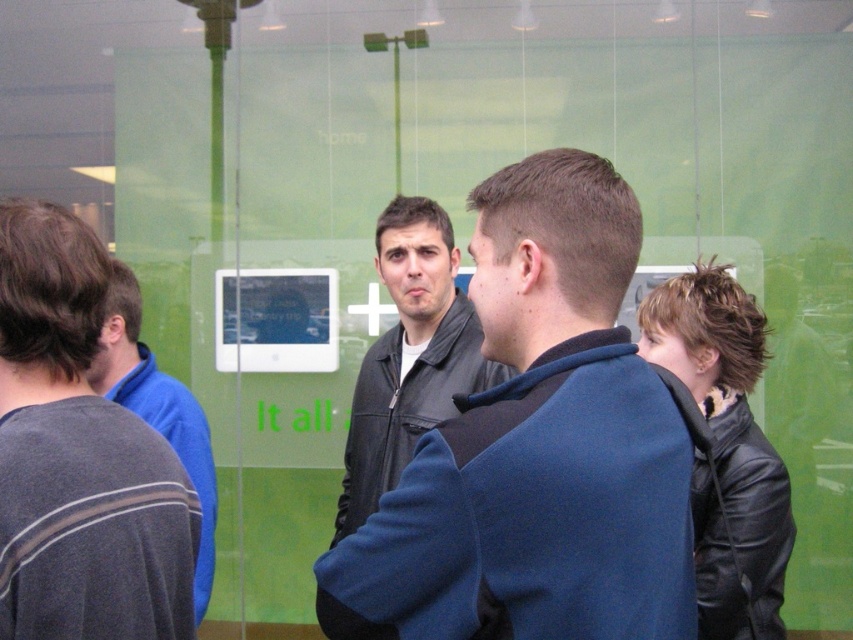
Question: Is the position of leather jacket at center less distant than that of dark gray leather jacket at center?

Choices:
 (A) no
 (B) yes

Answer: (B)

Question: Does leather jacket at center appear under dark gray leather jacket at center?

Choices:
 (A) yes
 (B) no

Answer: (B)

Question: Where is leather jacket at center located in relation to dark gray leather jacket at center in the image?

Choices:
 (A) right
 (B) left

Answer: (A)

Question: Among these points, which one is nearest to the camera?

Choices:
 (A) (619, 248)
 (B) (102, 426)
 (C) (728, 566)

Answer: (A)

Question: Which of the following is the closest to the observer?

Choices:
 (A) (531, 502)
 (B) (732, 484)
 (C) (431, 371)
 (D) (183, 532)

Answer: (A)

Question: Which point is closer to the camera?

Choices:
 (A) leather jacket at center
 (B) black leather jacket at lower right
 (C) dark gray leather jacket at center
 (D) blue fleece jacket at left

Answer: (A)